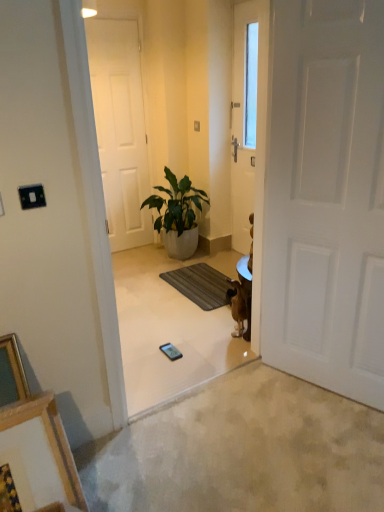
The height and width of the screenshot is (512, 384). In order to click on vacant space in front of white matte door at center, positioned as the second door in front-to-back order in this screenshot , I will do `click(129, 257)`.